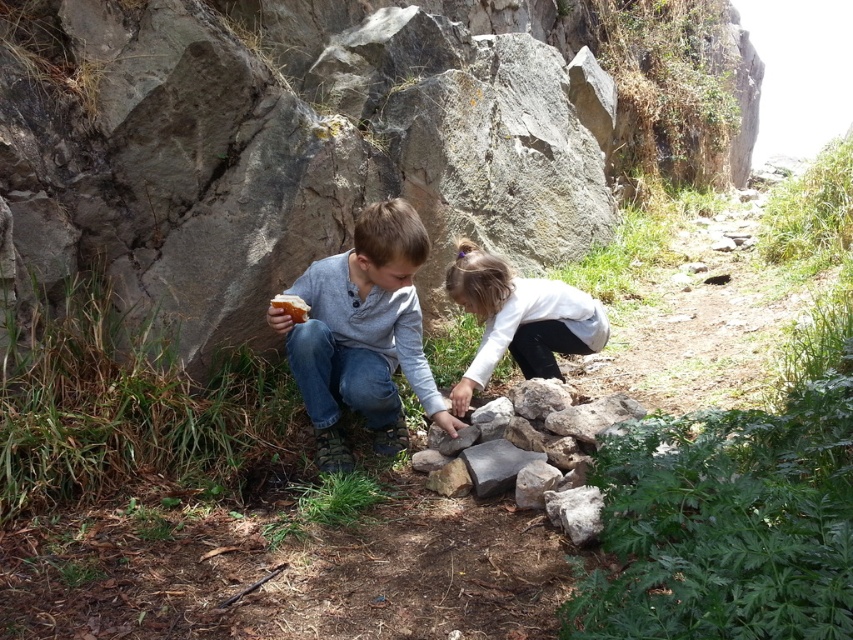
You are a photographer trying to capture a photo of the two children in the scene. You notice two points marked in the image. The first point is at coordinates point [312,378] and the second point is at coordinates point [485,339]. Which point is closer to the camera?

Point [312,378] is closer to the camera than point [485,339].